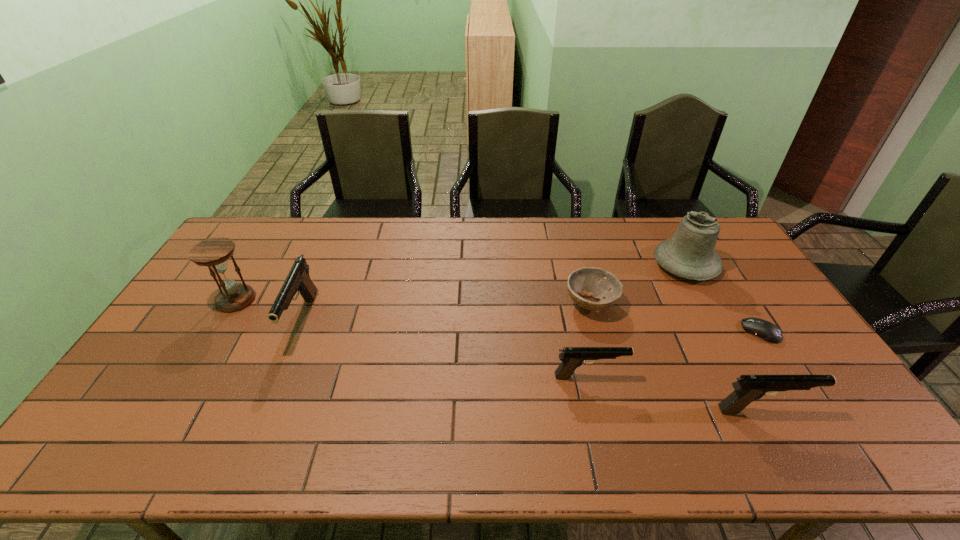
Locate an element on the screen. vacant area situated 0.180m at the muzzle of the second object from left to right is located at coordinates (265, 410).

Locate an element on the screen. free spot located 0.220m at the muzzle of the second pistol from left to right is located at coordinates (706, 376).

What are the coordinates of `vacant space located on the left of the bell` in the screenshot? It's located at (628, 265).

You are a GUI agent. You are given a task and a screenshot of the screen. Output one action in this format:
    pyautogui.click(x=<x>, y=<y>)
    Task: Click on the free space located on the front of the leftmost object
    
    Given the screenshot: What is the action you would take?
    179,396

The image size is (960, 540). Find the location of `free region located on the left of the bowl`. free region located on the left of the bowl is located at coordinates click(520, 303).

You are a GUI agent. You are given a task and a screenshot of the screen. Output one action in this format:
    pyautogui.click(x=<x>, y=<y>)
    Task: Click on the vacant space situated 0.390m on the back of the shortest object
    
    Given the screenshot: What is the action you would take?
    pyautogui.click(x=705, y=243)

Where is `object situated at the far edge`? object situated at the far edge is located at coordinates (690, 253).

The image size is (960, 540). Find the location of `object that is positioned at the near edge`. object that is positioned at the near edge is located at coordinates (748, 388).

The image size is (960, 540). I want to click on object located in the left edge section of the desktop, so click(214, 253).

What are the coordinates of `pistol present at the right edge` in the screenshot? It's located at (748, 388).